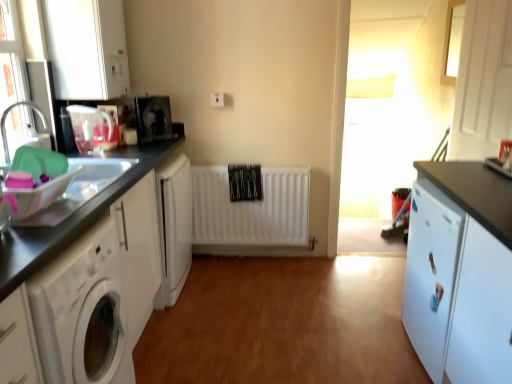
Describe the element at coordinates (153, 118) in the screenshot. I see `black plastic microwave at upper left, which is the first appliance from back to front` at that location.

At what (x,y) coordinates should I click in order to perform the action: click on white matte radiator at center. Please return your answer as a coordinate pair (x, y). Image resolution: width=512 pixels, height=384 pixels. Looking at the image, I should click on (251, 209).

Locate an element on the screen. brushed metal faucet at left is located at coordinates (31, 139).

Measure the distance between translucent plastic jug at left, placed as the 1th appliance when sorted from front to back, and camera.

A distance of 2.39 meters exists between translucent plastic jug at left, placed as the 1th appliance when sorted from front to back, and camera.

Measure the distance between point (66, 107) and camera.

The distance of point (66, 107) from camera is 2.43 meters.

In order to face white matte cabinet at left, arranged as the 2th cabinetry when viewed from the left, should I rotate leftwards or rightwards?

A 21.045 degree turn to the left will do.

The height and width of the screenshot is (384, 512). Find the location of `white matte cabinet at upper left, which is the 1th cabinetry in left-to-right order`. white matte cabinet at upper left, which is the 1th cabinetry in left-to-right order is located at coordinates (87, 48).

At what (x,y) coordinates should I click in order to perform the action: click on translucent plastic kettle at left, placed as the 2th appliance when sorted from back to front. Please return your answer as a coordinate pair (x, y). This screenshot has height=384, width=512. Looking at the image, I should click on (110, 128).

Measure the distance between translucent plastic sink at left and camera.

translucent plastic sink at left is 4.48 feet away from camera.

Locate an element on the screen. The image size is (512, 384). black plastic microwave at upper left, which is the first appliance from back to front is located at coordinates (153, 118).

In the scene shown: Would you consider white matte washing machine at left to be distant from translucent plastic kettle at left, placed as the 2th appliance when sorted from back to front?

white matte washing machine at left is positioned a significant distance from translucent plastic kettle at left, placed as the 2th appliance when sorted from back to front.

Is white matte washing machine at left surrounding translucent plastic kettle at left, placed as the 2th appliance when sorted from back to front?

No, translucent plastic kettle at left, placed as the 2th appliance when sorted from back to front, is not a part of white matte washing machine at left.

Consider the image. Considering the sizes of white matte washing machine at left and translucent plastic kettle at left, placed as the 2th appliance when sorted from back to front, in the image, is white matte washing machine at left bigger or smaller than translucent plastic kettle at left, placed as the 2th appliance when sorted from back to front,?

white matte washing machine at left is bigger than translucent plastic kettle at left, placed as the 2th appliance when sorted from back to front.

Is the position of white matte washing machine at left less distant than that of translucent plastic kettle at left, placed as the 2th appliance when sorted from back to front?

That is True.

From the picture: Is white matte washing machine at left placed right next to translucent plastic sink at left?

white matte washing machine at left and translucent plastic sink at left are not in contact.

Is white matte washing machine at left positioned with its back to translucent plastic sink at left?

white matte washing machine at left is not turned away from translucent plastic sink at left.

Is white matte washing machine at left positioned in front of translucent plastic sink at left?

Yes, white matte washing machine at left is in front of translucent plastic sink at left.

Which is behind, point (76, 303) or point (120, 159)?

The point (120, 159) is more distant.

From the picture: Is translucent plastic kettle at left, placed as the 2th appliance when sorted from back to front, inside translucent plastic sink at left?

No, translucent plastic sink at left does not contain translucent plastic kettle at left, placed as the 2th appliance when sorted from back to front.

Is translucent plastic sink at left turned away from translucent plastic kettle at left, placed as the 2th appliance when sorted from back to front?

No, translucent plastic sink at left's orientation is not away from translucent plastic kettle at left, placed as the 2th appliance when sorted from back to front.

Considering the positions of objects translucent plastic sink at left and translucent plastic kettle at left, the 2th appliance when ordered from front to back, in the image provided, who is more to the right, translucent plastic sink at left or translucent plastic kettle at left, the 2th appliance when ordered from front to back,?

From the viewer's perspective, translucent plastic sink at left appears more on the right side.

From the image's perspective, between translucent plastic sink at left and black plastic microwave at upper left, which ranks as the third appliance in front-to-back order, who is located below?

translucent plastic sink at left is shown below in the image.

Between translucent plastic sink at left and black plastic microwave at upper left, which ranks as the third appliance in front-to-back order, which one has larger width?

With larger width is translucent plastic sink at left.

Is point (113, 158) farther from camera compared to point (156, 114)?

That is False.

Is translucent plastic sink at left further to camera compared to black plastic microwave at upper left, which ranks as the third appliance in front-to-back order?

That is False.

Is translucent plastic sink at left at the right side of white matte washing machine at left?

No, translucent plastic sink at left is not to the right of white matte washing machine at left.

How far apart are translucent plastic sink at left and white matte washing machine at left?

A distance of 14.82 inches exists between translucent plastic sink at left and white matte washing machine at left.

Does point (29, 221) appear closer or farther from the camera than point (117, 300)?

Point (29, 221) is positioned closer to the camera compared to point (117, 300).

From a real-world perspective, does translucent plastic sink at left stand above white matte washing machine at left?

Yes, from a real-world perspective, translucent plastic sink at left is above white matte washing machine at left.

From the image's perspective, is white matte cabinet at upper left, the 3th cabinetry when ordered from right to left, above or below translucent plastic kettle at left, placed as the 2th appliance when sorted from back to front?

Clearly, from the image's perspective, white matte cabinet at upper left, the 3th cabinetry when ordered from right to left, is above translucent plastic kettle at left, placed as the 2th appliance when sorted from back to front.

Measure the distance between white matte cabinet at upper left, which is the 1th cabinetry in left-to-right order, and translucent plastic kettle at left, the 2th appliance when ordered from front to back.

white matte cabinet at upper left, which is the 1th cabinetry in left-to-right order, is 12.87 inches from translucent plastic kettle at left, the 2th appliance when ordered from front to back.

From a real-world perspective, is white matte cabinet at upper left, which is the 1th cabinetry in left-to-right order, positioned above or below translucent plastic kettle at left, placed as the 2th appliance when sorted from back to front?

In terms of real-world spatial position, white matte cabinet at upper left, which is the 1th cabinetry in left-to-right order, is above translucent plastic kettle at left, placed as the 2th appliance when sorted from back to front.

Looking at this image, is white matte cabinet at upper left, which is the 1th cabinetry in left-to-right order, looking in the opposite direction of translucent plastic kettle at left, the 2th appliance when ordered from front to back?

That's not correct — white matte cabinet at upper left, which is the 1th cabinetry in left-to-right order, is not looking away from translucent plastic kettle at left, the 2th appliance when ordered from front to back.

Does white glossy washing machine at lower left contain translucent plastic jug at left, placed as the 1th appliance when sorted from front to back?

No, translucent plastic jug at left, placed as the 1th appliance when sorted from front to back, is not surrounded by white glossy washing machine at lower left.

Considering the positions of point (263, 380) and point (100, 132), is point (263, 380) closer or farther from the camera than point (100, 132)?

Point (263, 380) is closer to the camera than point (100, 132).

From the picture: From a real-world perspective, which is physically below, white glossy washing machine at lower left or translucent plastic jug at left, placed as the 1th appliance when sorted from front to back?

white glossy washing machine at lower left, from a real-world perspective.

There is a white matte washing machine at left. Where is `the 1st appliance above it (from a real-world perspective)`? The height and width of the screenshot is (384, 512). the 1st appliance above it (from a real-world perspective) is located at coordinates (110, 128).

Identify the location of washing machine lying on the right of translucent plastic sink at left. The image size is (512, 384). (83, 312).

Estimate the real-world distances between objects in this image. Which object is closer to black plastic microwave at upper left, which is the first appliance from back to front, white matte cabinet at right, the first cabinetry in the right-to-left sequence, or white glossy washing machine at lower left?

white glossy washing machine at lower left is closer to black plastic microwave at upper left, which is the first appliance from back to front.

From the image, which object appears to be nearer to translucent plastic jug at left, placed as the 1th appliance when sorted from front to back, white plastic electric outlet at center or white matte radiator at center?

The object closer to translucent plastic jug at left, placed as the 1th appliance when sorted from front to back, is white plastic electric outlet at center.

Which object lies further to the anchor point black plastic microwave at upper left, which is the first appliance from back to front, translucent plastic kettle at left, placed as the 2th appliance when sorted from back to front, or white matte cabinet at left, arranged as the 2th cabinetry when viewed from the left?

white matte cabinet at left, arranged as the 2th cabinetry when viewed from the left, is positioned further to the anchor black plastic microwave at upper left, which is the first appliance from back to front.

Based on the photo, when comparing their distances from white matte cabinet at upper left, which is the 1th cabinetry in left-to-right order, does white matte cabinet at right, the first cabinetry in the right-to-left sequence, or translucent plastic kettle at left, the 2th appliance when ordered from front to back, seem further?

white matte cabinet at right, the first cabinetry in the right-to-left sequence.

When comparing their distances from brushed metal faucet at left, does white matte washing machine at left or white plastic electric outlet at center seem further?

The object further to brushed metal faucet at left is white plastic electric outlet at center.

Looking at the image, which one is located closer to white matte cabinet at upper left, which is the 1th cabinetry in left-to-right order, white matte washing machine at left or translucent plastic sink at left?

translucent plastic sink at left.

Looking at the image, which one is located further to translucent plastic jug at left, the third appliance in the back-to-front sequence, white matte cabinet at right, the third cabinetry when ordered from left to right, or translucent plastic sink at left?

white matte cabinet at right, the third cabinetry when ordered from left to right, is further to translucent plastic jug at left, the third appliance in the back-to-front sequence.

From the image, which object appears to be farther from white plastic electric outlet at center, white matte cabinet at right, the first cabinetry in the right-to-left sequence, or translucent plastic sink at left?

white matte cabinet at right, the first cabinetry in the right-to-left sequence, is positioned further to the anchor white plastic electric outlet at center.

Locate an element on the screen. sink between white matte washing machine at left and black plastic microwave at upper left, which ranks as the third appliance in front-to-back order, from front to back is located at coordinates (79, 189).

Where is `electric outlet between brushed metal faucet at left and white matte cabinet at right, the first cabinetry in the right-to-left sequence, in the horizontal direction`? electric outlet between brushed metal faucet at left and white matte cabinet at right, the first cabinetry in the right-to-left sequence, in the horizontal direction is located at coordinates (217, 100).

Locate an element on the screen. This screenshot has width=512, height=384. faucet between white matte washing machine at left and white matte radiator at center in the front-back direction is located at coordinates (31, 139).

Where is `plain located between white matte cabinet at left, the 2th cabinetry from the right, and white matte cabinet at right, the third cabinetry when ordered from left to right, in the left-right direction`? This screenshot has height=384, width=512. plain located between white matte cabinet at left, the 2th cabinetry from the right, and white matte cabinet at right, the third cabinetry when ordered from left to right, in the left-right direction is located at coordinates (282, 324).